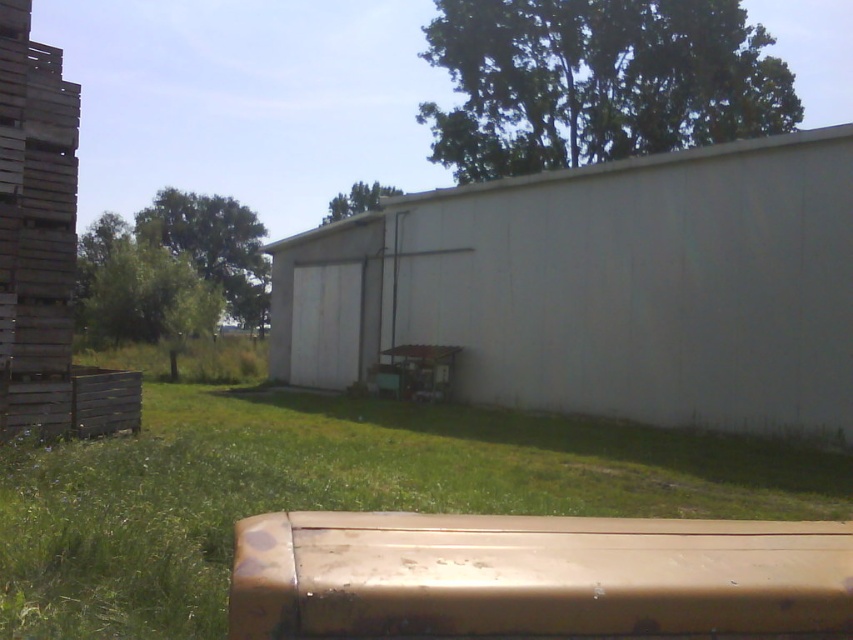
You are a painter who needs to paint the white concrete wall at center and the green grass at lower center. Since you have limited paint, which one requires more paint considering their height?

The white concrete wall at center requires more paint because it is taller than the green grass at lower center.

You are standing at the point marked by the coordinates point (x=601, y=289) in the image. Based on the scene description, what structure are you facing?

The point (x=601, y=289) indicates the white concrete wall at center, so you are facing the white concrete wall at center.